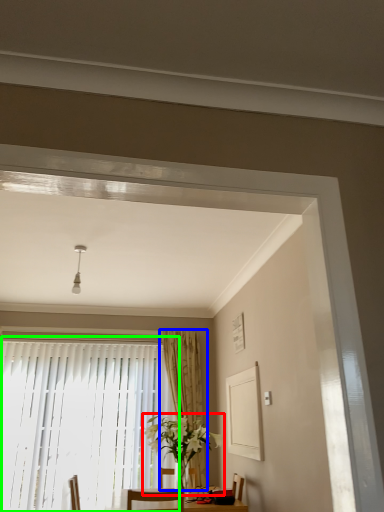
Question: Which object is positioned farthest from houseplant (highlighted by a red box)? Select from curtain (highlighted by a blue box) and window (highlighted by a green box).

Choices:
 (A) curtain
 (B) window

Answer: (B)